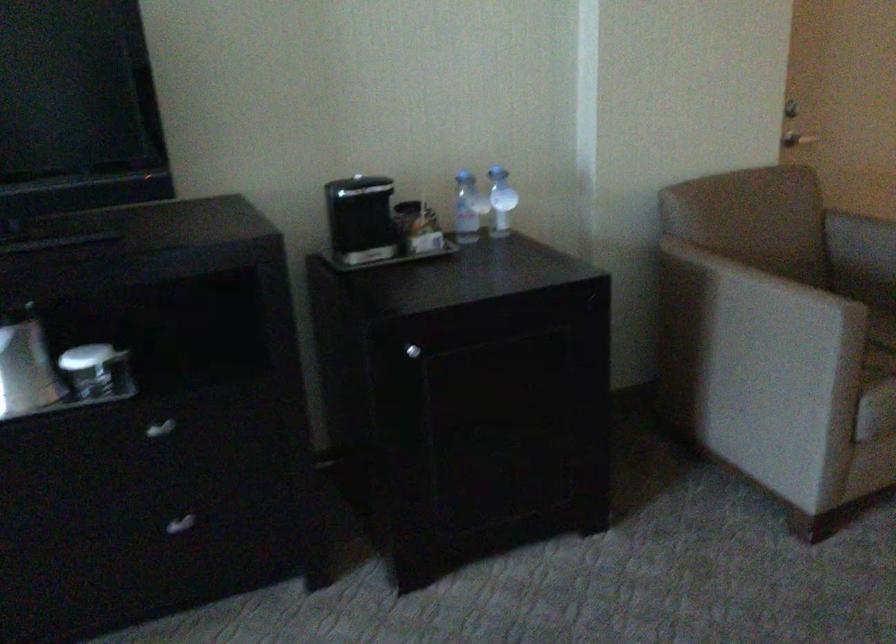
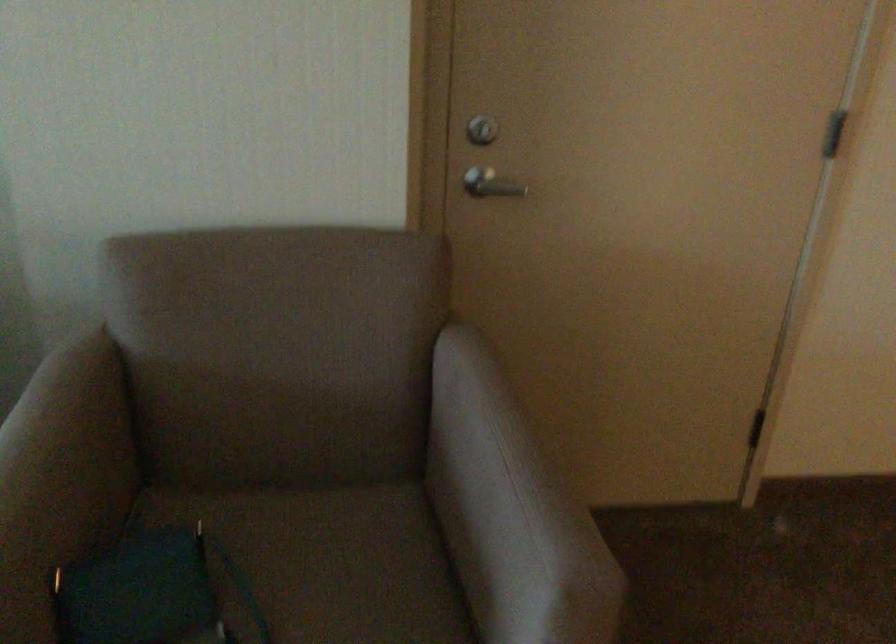
Looking at this image, in a continuous first-person perspective shot, in which direction is the camera moving?

The movement direction of the cameraman is right, forward.